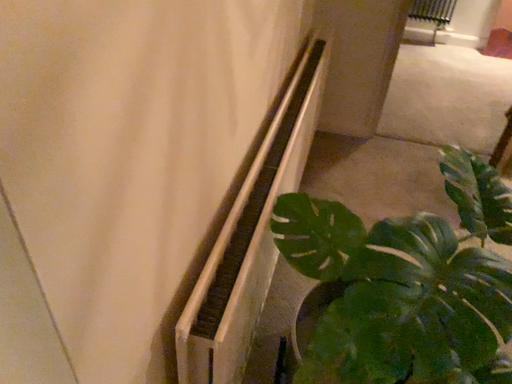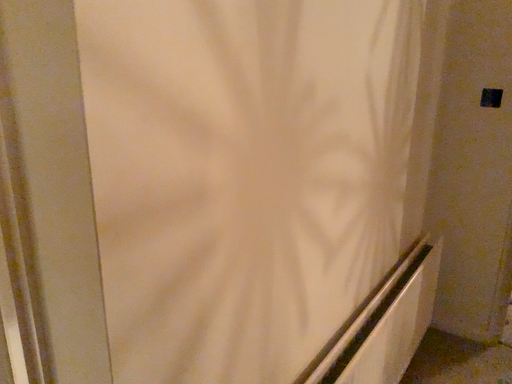
Question: How did the camera likely rotate when shooting the video?

Choices:
 (A) rotated right
 (B) rotated left

Answer: (B)